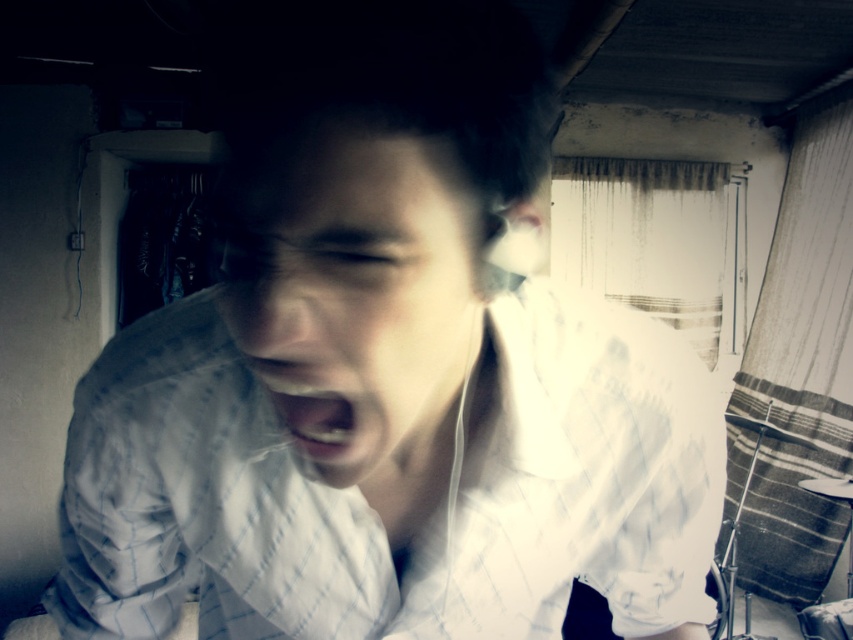
Consider the image. You are a photographer adjusting lighting for a portrait session. You notice the matte white earphones at center and the white glossy teeth at center in the frame. Which object should you focus on to ensure proper exposure, considering their size and position?

You should focus on the matte white earphones at center because it is bigger than the white glossy teeth at center, making it a more dominant subject for exposure adjustments.

You are a photographer trying to capture the perfect shot of the person in the scene. The matte white earphones at center are blocking the view of their face. Can you adjust your position to avoid the earphones without moving closer than 1 meter? The camera is at position point 0,0. The earphones are at point 0.466,0.422. The face is at point 0.5,0.5. Your camera can move in any direction except forward.

Yes, since the earphones at point (358, 298) are slightly to the left and below the face at point (426, 320), you can move the camera slightly to the right or upward to avoid blocking the face while maintaining the 1 meter distance requirement.

You are standing in the room and want to place a small plant between the two points, point (386,468) and point (273,385). Which point should the plant be closer to if you want it to be in front of the point that is further back?

The plant should be closer to point (273,385) because point (386,468) is behind point (273,385), so placing the plant near the front point ensures it is in front of the further one.